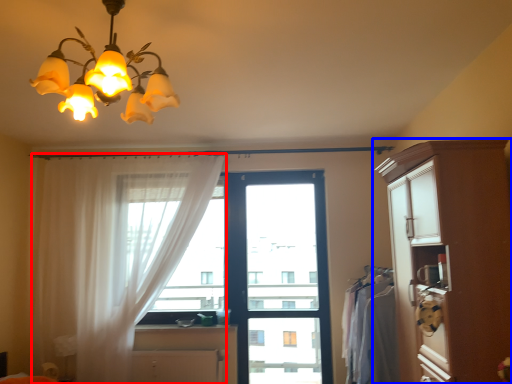
Question: Which object appears closest to the camera in this image, curtain (highlighted by a red box) or cabinetry (highlighted by a blue box)?

Choices:
 (A) curtain
 (B) cabinetry

Answer: (B)